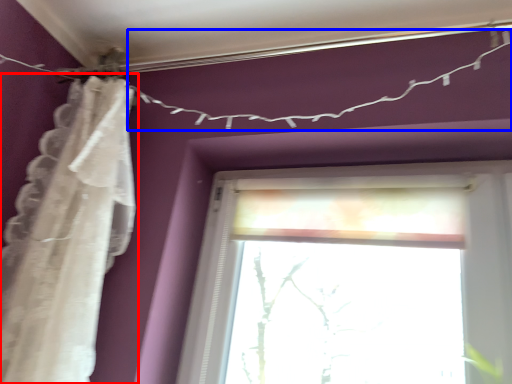
Question: Which of the following is the closest to the observer, curtain (highlighted by a red box) or clothesline (highlighted by a blue box)?

Choices:
 (A) curtain
 (B) clothesline

Answer: (A)